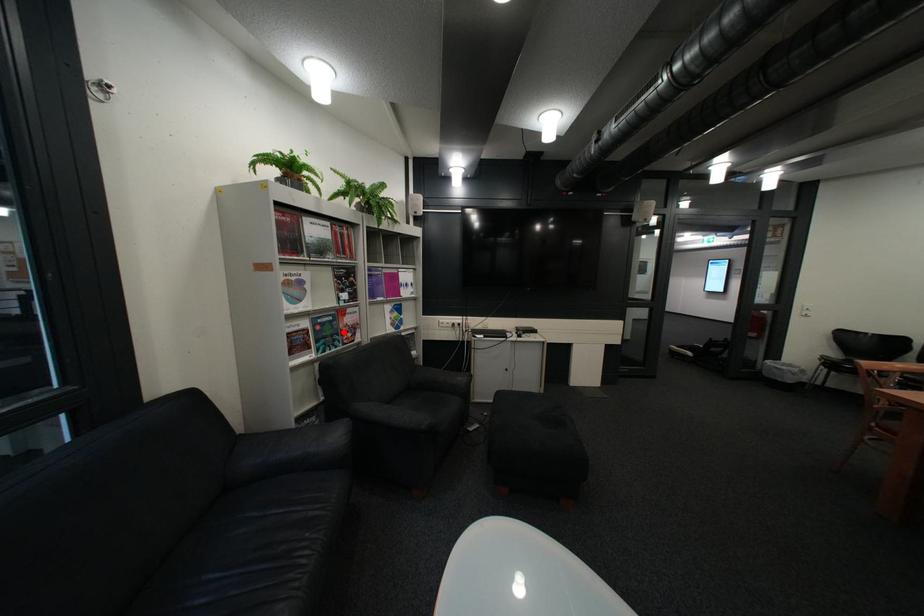
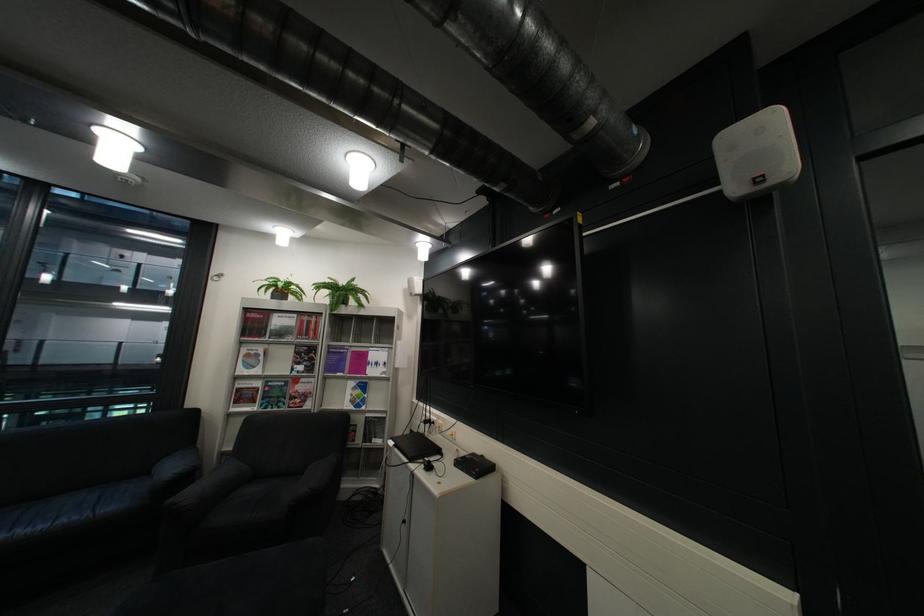
Question: A red point is marked in image1. In image2, is the corresponding 3D point closer to the camera or farther? Reply with the corresponding letter.

Choices:
 (A) The corresponding 3D point is closer.
 (B) The corresponding 3D point is farther.

Answer: (B)